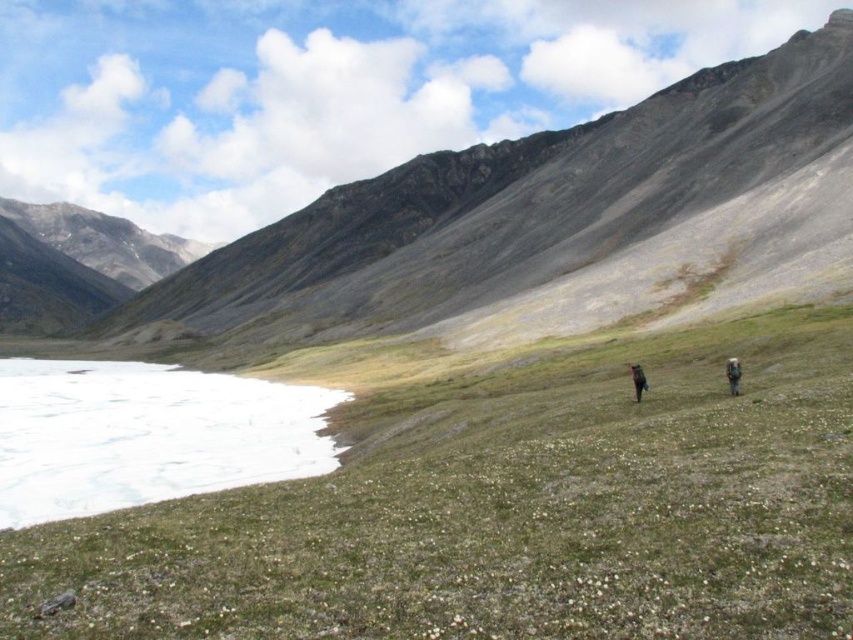
You are a hiker planning to cross the grassy plain in the image. You see the white ice at lower left and the dark gray backpack at right. Which object is closer to your starting point on the left side of the path?

The white ice at lower left is positioned on the left side of the dark gray backpack at right, so it is closer to your starting point on the left side of the path.

You are a hiker standing at the base of the mountain. You spot two points marked on the landscape. One is at coordinate point (x=235, y=397) and the other at point (x=635, y=380). Which point is closer to your current position?

Point (x=235, y=397) is closer to your current position because it is further to the viewer than point (x=635, y=380), meaning it is nearer to you.